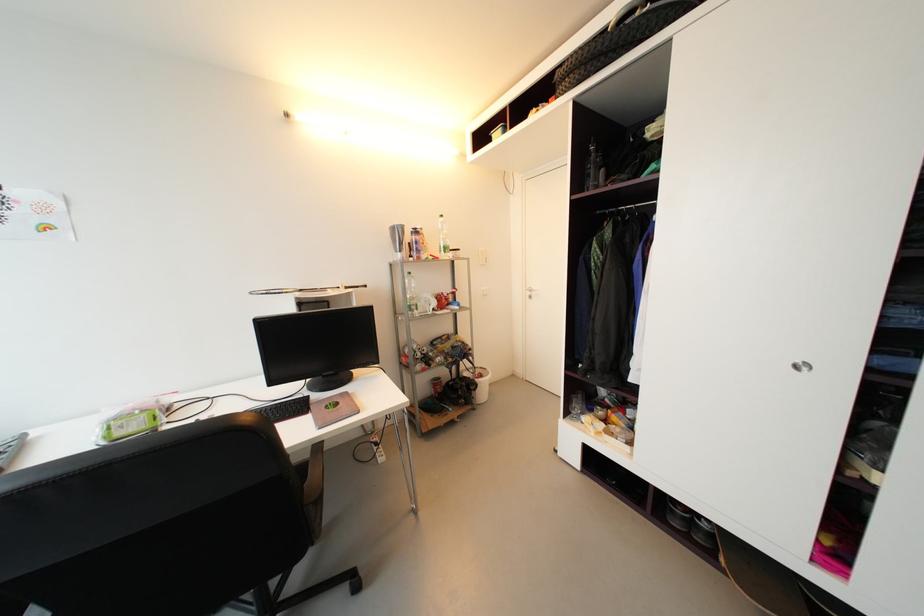
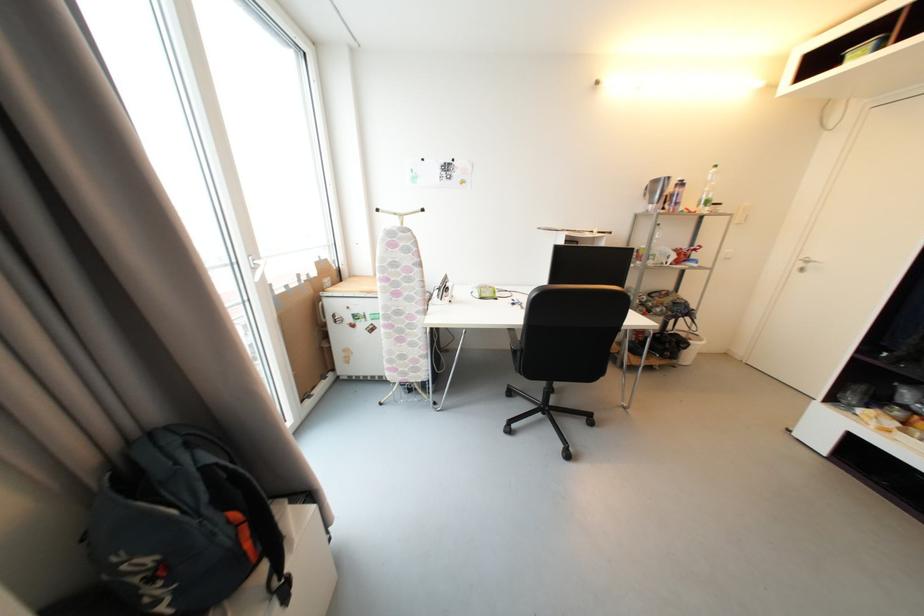
Find the pixel in the second image that matches pixel 412 238 in the first image.

(674, 192)